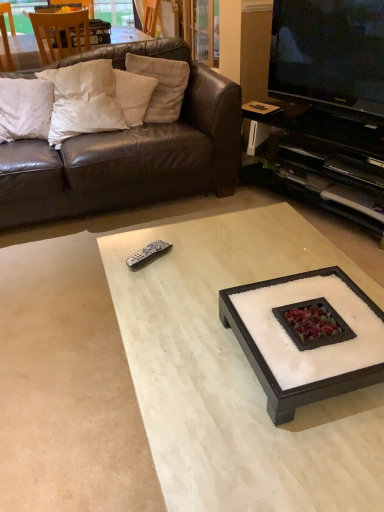
Question: From the image's perspective, relative to black glossy television at upper right, is white marble coffee table at center, which is the 1th coffee table in bottom-to-top order, above or below?

Choices:
 (A) below
 (B) above

Answer: (A)

Question: Looking at their shapes, would you say white marble coffee table at center, positioned as the 2th coffee table in top-to-bottom order, is wider or thinner than black glossy television at upper right?

Choices:
 (A) thin
 (B) wide

Answer: (B)

Question: Which object is the farthest from the white marble coffee table at center, which is the 1th coffee table in bottom-to-top order?

Choices:
 (A) white marble coffee table at center, which is the second coffee table in bottom-to-top order
 (B) white soft pillow at upper left, which ranks as the 3th pillow in right-to-left order
 (C) white soft pillow at upper left, acting as the second pillow starting from the right
 (D) brown leather couch at upper left
 (E) black glossy television at upper right

Answer: (C)

Question: Which object is positioned closest to the white soft pillow at upper left, the fourth pillow viewed from the right?

Choices:
 (A) white marble coffee table at center, which is the second coffee table in bottom-to-top order
 (B) white marble coffee table at center, positioned as the 2th coffee table in top-to-bottom order
 (C) white soft pillow at upper left, arranged as the 3th pillow when viewed from the left
 (D) black glossy television at upper right
 (E) wooden chair at upper left

Answer: (C)